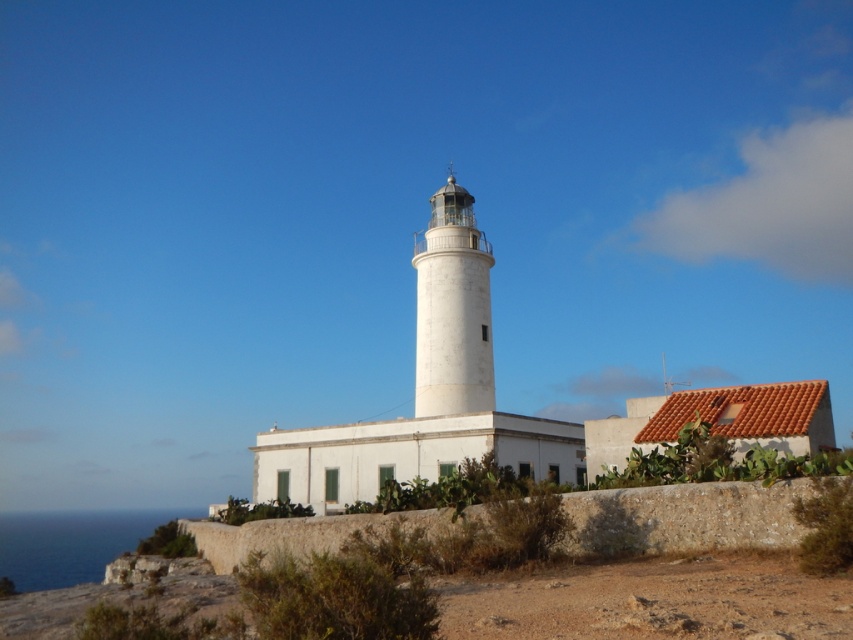
You are a visitor standing at the edge of the brown rough stone wall at lower center, looking towards the white smooth lighthouse at center. Which structure appears taller from your vantage point?

The white smooth lighthouse at center appears taller than the brown rough stone wall at lower center because the brown rough stone wall at lower center has a lesser height compared to the white smooth lighthouse at center.